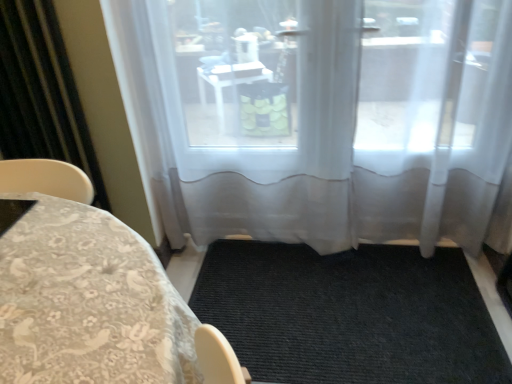
The width and height of the screenshot is (512, 384). Find the location of `patterned fabric tablecloth at lower left`. patterned fabric tablecloth at lower left is located at coordinates (88, 302).

What are the coordinates of `black textured mat at center` in the screenshot? It's located at (350, 314).

Does black sheer curtain at left come in front of black textured mat at center?

That is False.

How many degrees apart are the facing directions of black sheer curtain at left and black textured mat at center?

black sheer curtain at left and black textured mat at center are facing 1.66 degrees away from each other.

What are the coordinates of `doormat in front of the black sheer curtain at left` in the screenshot? It's located at (350, 314).

Can you confirm if black sheer curtain at left is taller than black textured mat at center?

Correct, black sheer curtain at left is much taller as black textured mat at center.

How different are the orientations of black textured mat at center and black sheer curtain at left in degrees?

black textured mat at center and black sheer curtain at left are facing 1.66 degrees away from each other.

Is black textured mat at center taller or shorter than black sheer curtain at left?

Considering their sizes, black textured mat at center has less height than black sheer curtain at left.

Is black textured mat at center facing away from black sheer curtain at left?

No, black textured mat at center is not facing the opposite direction of black sheer curtain at left.

Is black textured mat at center in front of black sheer curtain at left?

Yes.

Are transparent fabric at center and black sheer curtain at left far apart?

That's not correct — transparent fabric at center is a little close to black sheer curtain at left.

Find the location of `curtain on the left of the transparent fabric at center`. curtain on the left of the transparent fabric at center is located at coordinates (41, 93).

Considering the points (489, 75) and (35, 70), which point is in front, point (489, 75) or point (35, 70)?

Positioned in front is point (35, 70).

Considering the positions of objects patterned fabric tablecloth at lower left and black sheer curtain at left in the image provided, who is behind, patterned fabric tablecloth at lower left or black sheer curtain at left?

black sheer curtain at left is further from the camera.

Considering the sizes of patterned fabric tablecloth at lower left and black sheer curtain at left in the image, is patterned fabric tablecloth at lower left taller or shorter than black sheer curtain at left?

patterned fabric tablecloth at lower left is shorter than black sheer curtain at left.

Is patterned fabric tablecloth at lower left positioned far away from black sheer curtain at left?

That's not correct — patterned fabric tablecloth at lower left is a little close to black sheer curtain at left.

How distant is patterned fabric tablecloth at lower left from black sheer curtain at left?

patterned fabric tablecloth at lower left and black sheer curtain at left are 32.71 inches apart from each other.

Which is more to the left, black sheer curtain at left or patterned fabric tablecloth at lower left?

From the viewer's perspective, black sheer curtain at left appears more on the left side.

Is black sheer curtain at left thinner than patterned fabric tablecloth at lower left?

Yes, black sheer curtain at left is thinner than patterned fabric tablecloth at lower left.

Image resolution: width=512 pixels, height=384 pixels. What are the coordinates of `curtain that is above the patterned fabric tablecloth at lower left (from a real-world perspective)` in the screenshot? It's located at (41, 93).

Which is closer, (109, 347) or (348, 187)?

The point (109, 347) is more forward.

How distant is patterned fabric tablecloth at lower left from transparent fabric at center?

patterned fabric tablecloth at lower left and transparent fabric at center are 1.02 meters apart from each other.

Considering the relative positions of patterned fabric tablecloth at lower left and transparent fabric at center in the image provided, is patterned fabric tablecloth at lower left to the left of transparent fabric at center from the viewer's perspective?

Yes.

Is patterned fabric tablecloth at lower left taller than transparent fabric at center?

No, patterned fabric tablecloth at lower left is not taller than transparent fabric at center.

Considering the positions of point (244, 247) and point (347, 0), is point (244, 247) closer or farther from the camera than point (347, 0)?

Point (244, 247) is positioned farther from the camera compared to point (347, 0).

Is black textured mat at center facing towards transparent fabric at center?

No, black textured mat at center is not oriented towards transparent fabric at center.

Based on the photo, is black textured mat at center placed right next to transparent fabric at center?

No.

Image resolution: width=512 pixels, height=384 pixels. What are the coordinates of `curtain on the left of black textured mat at center` in the screenshot? It's located at (41, 93).

Locate an element on the screen. The width and height of the screenshot is (512, 384). doormat in front of the black sheer curtain at left is located at coordinates (350, 314).

Looking at the image, which one is located further to patterned fabric tablecloth at lower left, transparent fabric at center or black sheer curtain at left?

transparent fabric at center.

When comparing their distances from patterned fabric tablecloth at lower left, does black sheer curtain at left or transparent fabric at center seem closer?

Among the two, black sheer curtain at left is located nearer to patterned fabric tablecloth at lower left.

Based on their spatial positions, is patterned fabric tablecloth at lower left or black sheer curtain at left closer to transparent fabric at center?

black sheer curtain at left lies closer to transparent fabric at center than the other object.

Looking at the image, which one is located further to black sheer curtain at left, black textured mat at center or transparent fabric at center?

black textured mat at center is further to black sheer curtain at left.

Looking at this image, based on their spatial positions, is transparent fabric at center or black sheer curtain at left further from black textured mat at center?

black sheer curtain at left is positioned further to the anchor black textured mat at center.

Looking at the image, which one is located closer to transparent fabric at center, black textured mat at center or patterned fabric tablecloth at lower left?

Among the two, black textured mat at center is located nearer to transparent fabric at center.

Considering their positions, is patterned fabric tablecloth at lower left positioned closer to transparent fabric at center than black textured mat at center?

Among the two, black textured mat at center is located nearer to transparent fabric at center.

Which object lies nearer to the anchor point black textured mat at center, patterned fabric tablecloth at lower left or black sheer curtain at left?

patterned fabric tablecloth at lower left is positioned closer to the anchor black textured mat at center.

The image size is (512, 384). I want to click on window between black sheer curtain at left and black textured mat at center in the horizontal direction, so click(318, 116).

Find the location of `window situated between patterned fabric tablecloth at lower left and black textured mat at center from left to right`. window situated between patterned fabric tablecloth at lower left and black textured mat at center from left to right is located at coordinates (318, 116).

Locate an element on the screen. The width and height of the screenshot is (512, 384). furniture between black sheer curtain at left and black textured mat at center is located at coordinates (88, 302).

Where is `furniture between black sheer curtain at left and transparent fabric at center from left to right`? furniture between black sheer curtain at left and transparent fabric at center from left to right is located at coordinates (x=88, y=302).